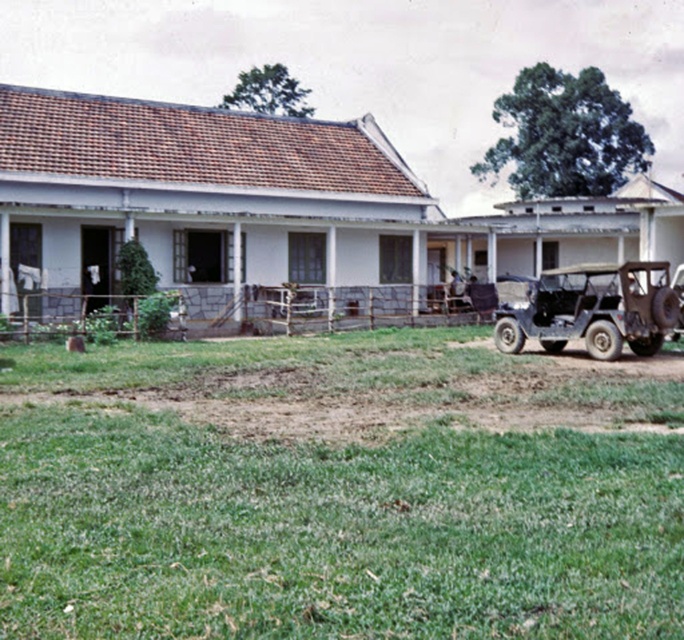
Question: Estimate the real-world distances between objects in this image. Which object is farther from the green matte jeep at lower right?

Choices:
 (A) rusty metal jeep at right
 (B) green grass lawn at lower center

Answer: (B)

Question: Can you confirm if green grass lawn at lower center is positioned to the left of rusty metal jeep at right?

Choices:
 (A) no
 (B) yes

Answer: (B)

Question: Among these objects, which one is nearest to the camera?

Choices:
 (A) rusty metal jeep at right
 (B) green matte jeep at lower right
 (C) green grass lawn at lower center

Answer: (C)

Question: Which point appears farthest from the camera in this image?

Choices:
 (A) (672, 275)
 (B) (642, 557)
 (C) (644, 273)

Answer: (A)

Question: Observing the image, what is the correct spatial positioning of green grass lawn at lower center in reference to green matte jeep at lower right?

Choices:
 (A) left
 (B) right

Answer: (A)

Question: Does green grass lawn at lower center appear under green matte jeep at lower right?

Choices:
 (A) yes
 (B) no

Answer: (A)